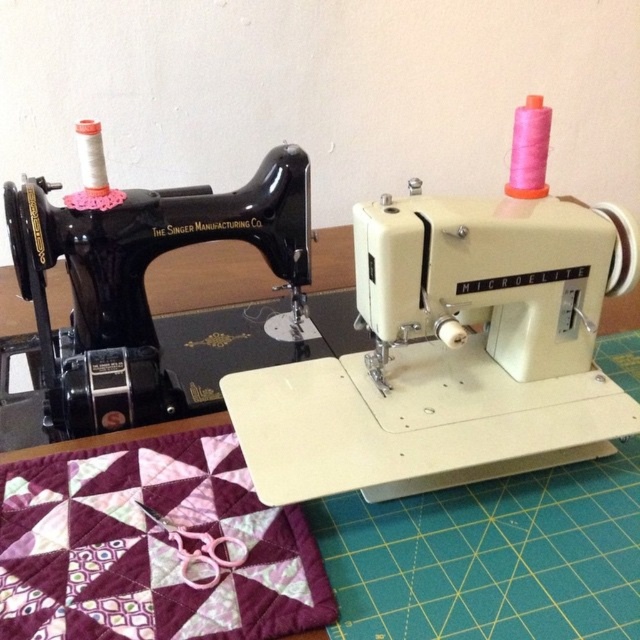
You are a tailor who needs to choose a sewing machine that is shorter in height to avoid hitting the low ceiling in your workshop. Which sewing machine should you choose between the white plastic sewing machine at center and the black glossy singer manufacturing co sewing machine at left?

The black glossy singer manufacturing co sewing machine at left is shorter than the white plastic sewing machine at center, so you should choose the black glossy singer manufacturing co sewing machine at left to avoid hitting the low ceiling.

You are a photographer standing at the camera position. You want to take a closeup photo of the white plastic sewing machine at center. Can you move closer to the sewing machine to get a better shot without moving the camera? Explain why or why not based on the distance provided.

The white plastic sewing machine at center and camera are 26.28 inches apart. Since you cannot move the camera, you cannot get closer than 26.28 inches to the sewing machine for the closeup photo.